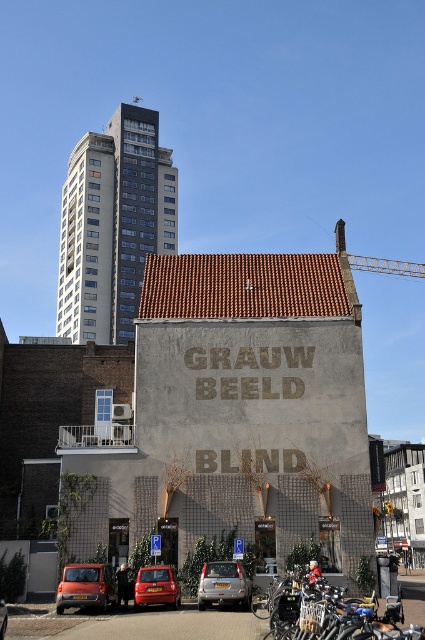
Question: Is silver metallic car at center to the left of matte red car at lower center from the viewer's perspective?

Choices:
 (A) no
 (B) yes

Answer: (A)

Question: Is matte orange car at lower left positioned behind metallic gray crane at upper right?

Choices:
 (A) yes
 (B) no

Answer: (B)

Question: Which point is farther to the camera?

Choices:
 (A) matte red car at lower center
 (B) matte orange car at lower left
 (C) silver metallic car at center

Answer: (A)

Question: Which point is farther from the camera taking this photo?

Choices:
 (A) (419, 272)
 (B) (65, 566)

Answer: (A)

Question: Considering the real-world distances, which object is farthest from the matte orange car at lower left?

Choices:
 (A) metallic gray crane at upper right
 (B) matte red car at lower center
 (C) silver metallic car at center

Answer: (A)

Question: Is silver metallic car at center above matte red car at lower center?

Choices:
 (A) yes
 (B) no

Answer: (B)